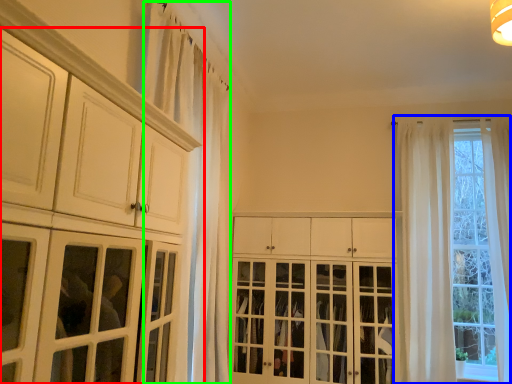
Question: Estimate the real-world distances between objects in this image. Which object is farther from cabinetry (highlighted by a red box), window (highlighted by a blue box) or curtain (highlighted by a green box)?

Choices:
 (A) window
 (B) curtain

Answer: (A)